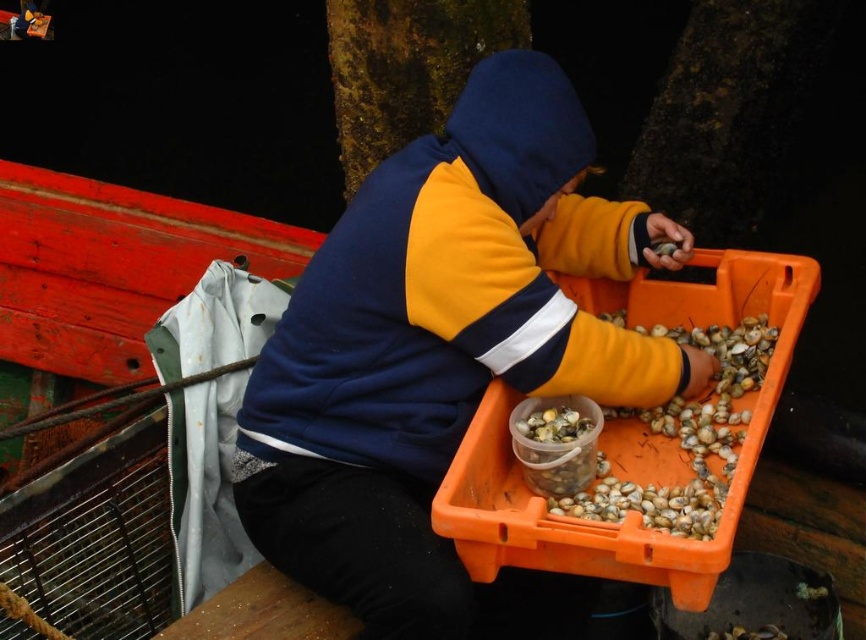
Does translucent plastic shells at lower right have a greater height compared to translucent plastic container at center?

Yes, translucent plastic shells at lower right is taller than translucent plastic container at center.

Is translucent plastic shells at lower right positioned at the back of translucent plastic container at center?

That is False.

Between point (703, 429) and point (585, 417), which one is positioned in front?

Positioned in front is point (703, 429).

Find the location of `translucent plastic shells at lower right`. translucent plastic shells at lower right is located at coordinates (682, 438).

Does matte blue and yellow hoodie at center have a greater height compared to translucent plastic shells at lower right?

Indeed, matte blue and yellow hoodie at center has a greater height compared to translucent plastic shells at lower right.

This screenshot has height=640, width=866. What do you see at coordinates (444, 356) in the screenshot? I see `matte blue and yellow hoodie at center` at bounding box center [444, 356].

Which is behind, point (515, 252) or point (745, 419)?

The point (745, 419) is more distant.

Where is `matte blue and yellow hoodie at center`? The image size is (866, 640). matte blue and yellow hoodie at center is located at coordinates (444, 356).

Does matte blue and yellow hoodie at center have a larger size compared to translucent plastic container at center?

Correct, matte blue and yellow hoodie at center is larger in size than translucent plastic container at center.

Does matte blue and yellow hoodie at center come behind translucent plastic container at center?

No, matte blue and yellow hoodie at center is in front of translucent plastic container at center.

You are a GUI agent. You are given a task and a screenshot of the screen. Output one action in this format:
    pyautogui.click(x=<x>, y=<y>)
    Task: Click on the matte blue and yellow hoodie at center
    The width and height of the screenshot is (866, 640).
    Given the screenshot: What is the action you would take?
    pyautogui.click(x=444, y=356)